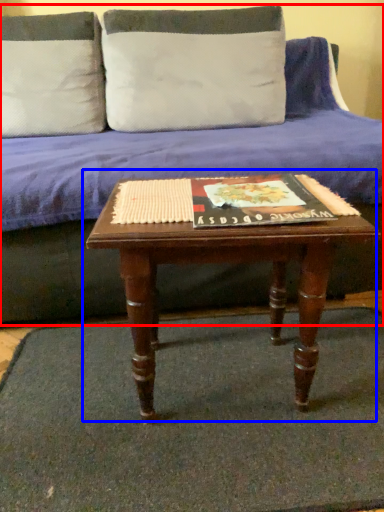
Question: Which object appears farthest to the camera in this image, studio couch (highlighted by a red box) or coffee table (highlighted by a blue box)?

Choices:
 (A) studio couch
 (B) coffee table

Answer: (A)